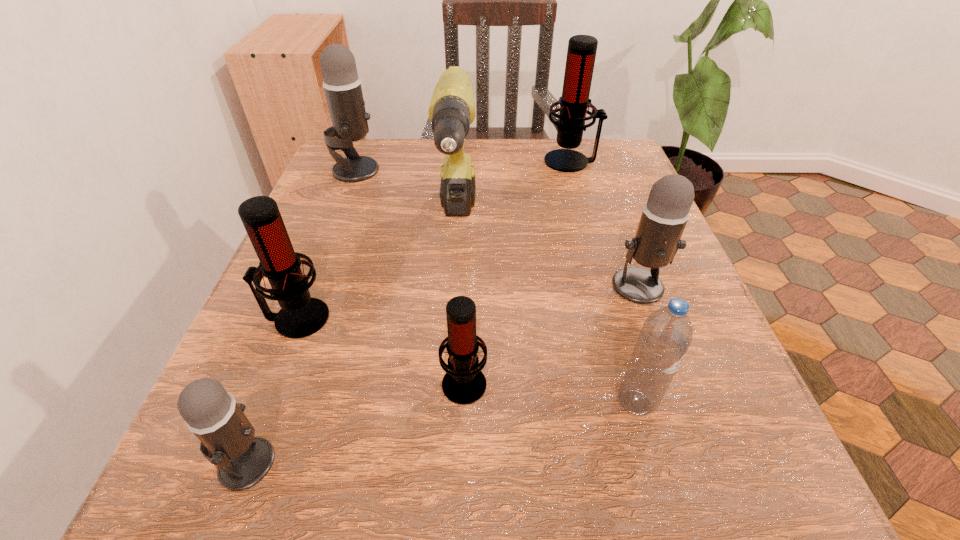
Identify the location of the biggest red microphone. The width and height of the screenshot is (960, 540). (581, 53).

Where is `the rightmost red microphone`? Image resolution: width=960 pixels, height=540 pixels. the rightmost red microphone is located at coordinates (581, 53).

Where is `the farthest gray microphone`? The image size is (960, 540). the farthest gray microphone is located at coordinates (342, 85).

Where is `drill`? This screenshot has height=540, width=960. drill is located at coordinates (452, 109).

Locate an element on the screen. the second smallest red microphone is located at coordinates 300,316.

Identify the location of the second farthest red microphone. This screenshot has height=540, width=960. (300, 316).

At what (x,y) coordinates should I click in order to perform the action: click on the second biggest gray microphone. Please return your answer as a coordinate pair (x, y). Looking at the image, I should click on (658, 237).

The width and height of the screenshot is (960, 540). What are the coordinates of `the second farthest gray microphone` in the screenshot? It's located at (658, 237).

Find the location of `blue water bottle`. blue water bottle is located at coordinates (666, 335).

Where is `the second red microphone from right to left`? the second red microphone from right to left is located at coordinates (464, 383).